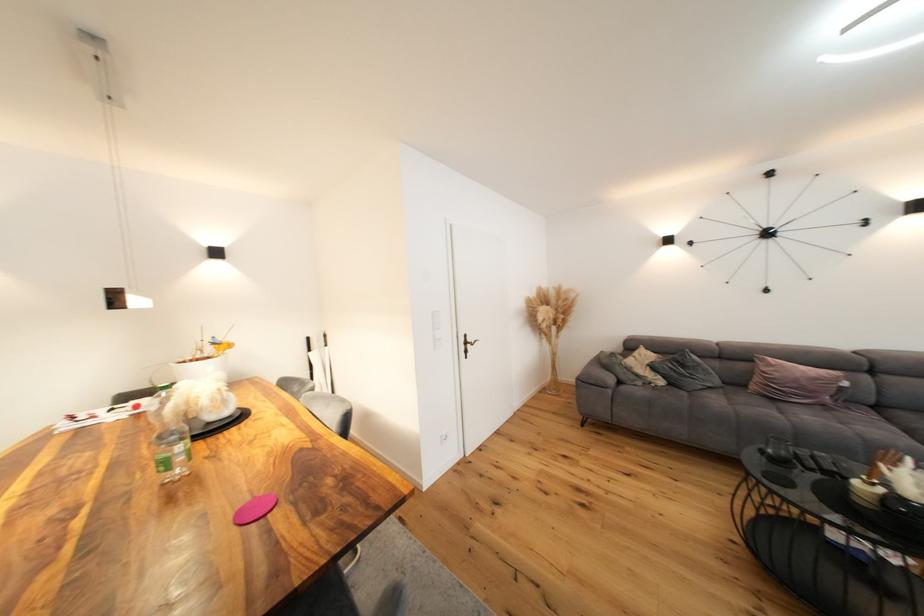
In order to click on grey pillow in this screenshot , I will do `click(686, 371)`.